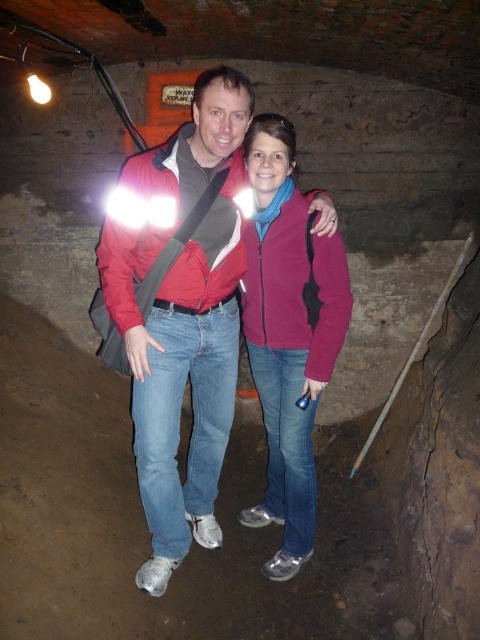
Does point (206, 362) come closer to viewer compared to point (250, 260)?

No.

Between matte red jacket at center and matte pink jacket at center, which one has less height?

With less height is matte pink jacket at center.

Identify the location of matte red jacket at center. (180, 316).

Locate an element on the screen. matte red jacket at center is located at coordinates click(180, 316).